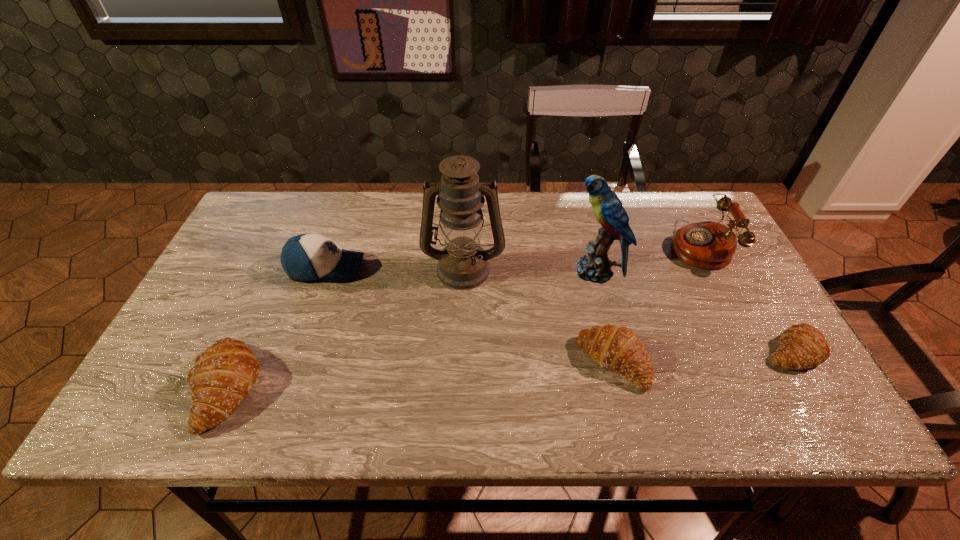
The width and height of the screenshot is (960, 540). In the image, there is a desktop. In order to click on vacant space at the right edge in this screenshot , I will do `click(745, 345)`.

I want to click on free space at the far left corner, so click(x=253, y=223).

This screenshot has width=960, height=540. In the image, there is a desktop. What are the coordinates of `vacant space at the far right corner` in the screenshot? It's located at (679, 215).

In the image, there is a desktop. At what (x,y) coordinates should I click in order to perform the action: click on vacant space at the near right corner. Please return your answer as a coordinate pair (x, y). The image size is (960, 540). Looking at the image, I should click on (748, 380).

Where is `vacant space that is in between the fifth shortest object and the second tallest object`? vacant space that is in between the fifth shortest object and the second tallest object is located at coordinates (647, 259).

Find the location of `vacant area that lies between the second crescent roll from left to right and the leftmost crescent roll`. vacant area that lies between the second crescent roll from left to right and the leftmost crescent roll is located at coordinates (420, 375).

You are a GUI agent. You are given a task and a screenshot of the screen. Output one action in this format:
    pyautogui.click(x=<x>, y=<y>)
    Task: Click on the unoccupied area between the parrot and the leftmost crescent roll
    The width and height of the screenshot is (960, 540).
    Given the screenshot: What is the action you would take?
    pyautogui.click(x=411, y=330)

This screenshot has height=540, width=960. Find the location of `vacant space that is in between the oil lamp and the sixth tallest object`. vacant space that is in between the oil lamp and the sixth tallest object is located at coordinates (538, 315).

Where is `free point between the fifth object from right to left and the leftmost crescent roll`? This screenshot has height=540, width=960. free point between the fifth object from right to left and the leftmost crescent roll is located at coordinates (345, 328).

This screenshot has width=960, height=540. Find the location of `vacant area that lies between the oil lamp and the second shortest crescent roll`. vacant area that lies between the oil lamp and the second shortest crescent roll is located at coordinates (538, 315).